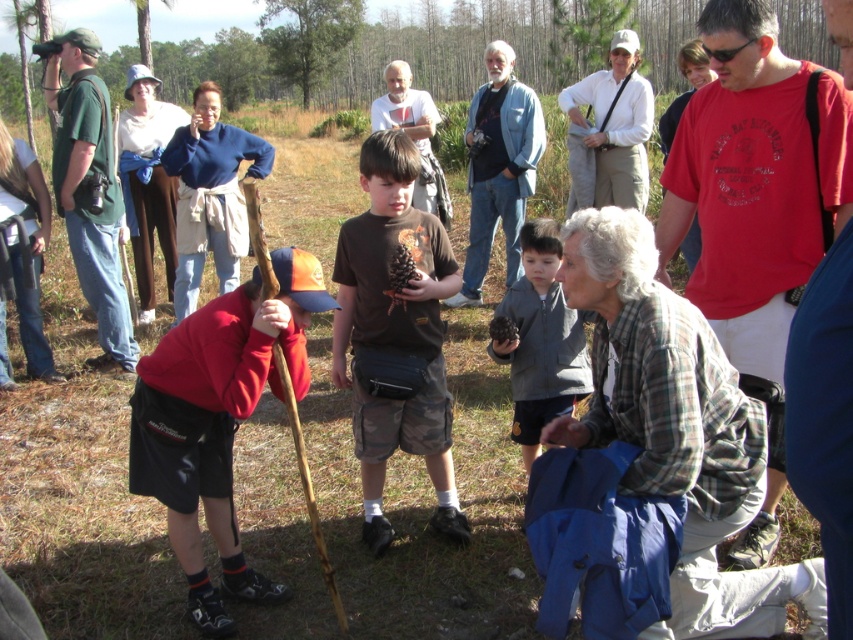
You are standing at the origin point in the image and want to move towards the brown cotton shirt at center. Which direction should you head in to reach it?

To reach the brown cotton shirt at center, you should head towards the coordinates specified at point (395, 333).

You are standing in the park and see the green cotton shirt at left and the green leafy tree at upper center. Which object is positioned more to the right from your viewpoint?

The green cotton shirt at left is positioned to the right of the green leafy tree at upper center, so the green cotton shirt at left is more to the right.